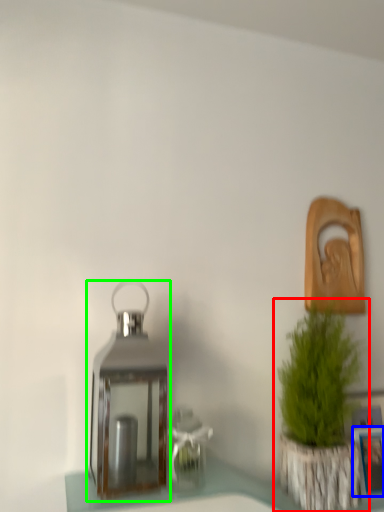
Question: Estimate the real-world distances between objects in this image. Which object is closer to houseplant (highlighted by a red box), picture frame (highlighted by a blue box) or lantern (highlighted by a green box)?

Choices:
 (A) picture frame
 (B) lantern

Answer: (A)